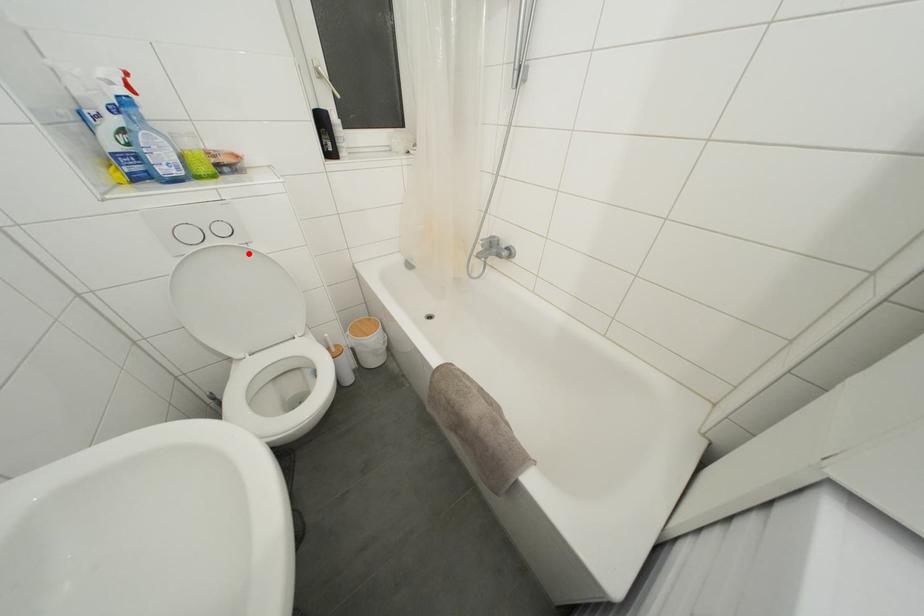
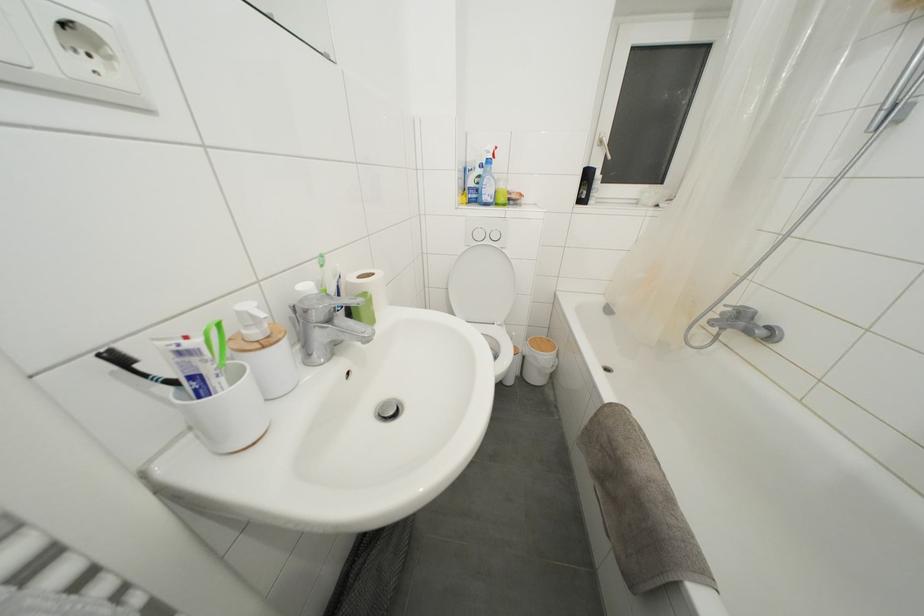
Question: I am providing you with two images of the same scene from different viewpoints. Given a red point in image1, look at the same physical point in image2. Is it:

Choices:
 (A) Closer to the viewpoint
 (B) Farther from the viewpoint

Answer: (B)